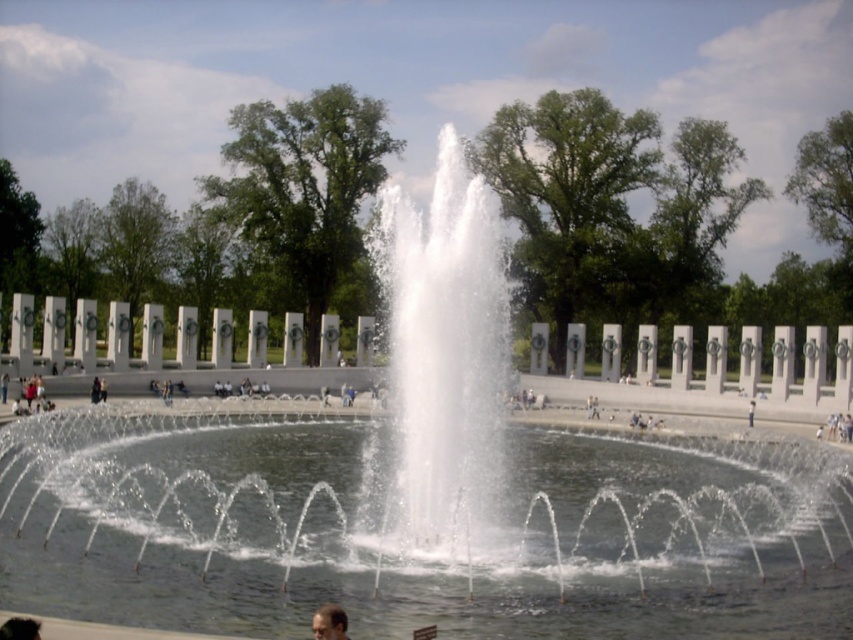
You are standing at the fountain and want to walk to the point that is closer to you. Which point should you head towards, point (335, 616) or point (10, 618)?

You should head towards point (335, 616) because it is closer to the viewer than point (10, 618).

You are a photographer taking a portrait of a person in the park. You notice the smooth skin face at lower center and dark brown hair at lower left. Which object should you focus on first to ensure the person looks natural in the photo?

The smooth skin face at lower center should be focused on first because it is located below the dark brown hair at lower left, making it the primary feature of the person.

You are a photographer taking a picture of the smooth skin face at lower center and the dark brown hair at lower left. Which object should you focus on first to ensure both are in sharp focus?

You should focus on the dark brown hair at lower left first because it is behind the smooth skin face at lower center, so focusing on the background object first ensures both are in focus.